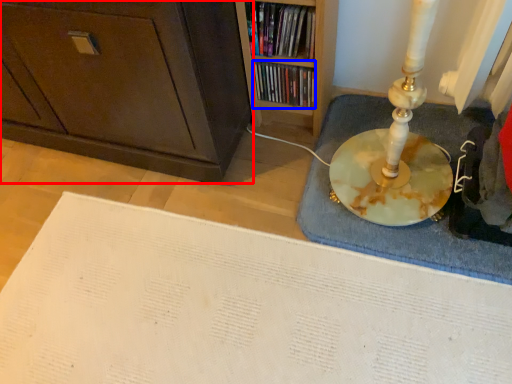
Question: Which object is further to the camera taking this photo, cabinetry (highlighted by a red box) or book (highlighted by a blue box)?

Choices:
 (A) cabinetry
 (B) book

Answer: (B)